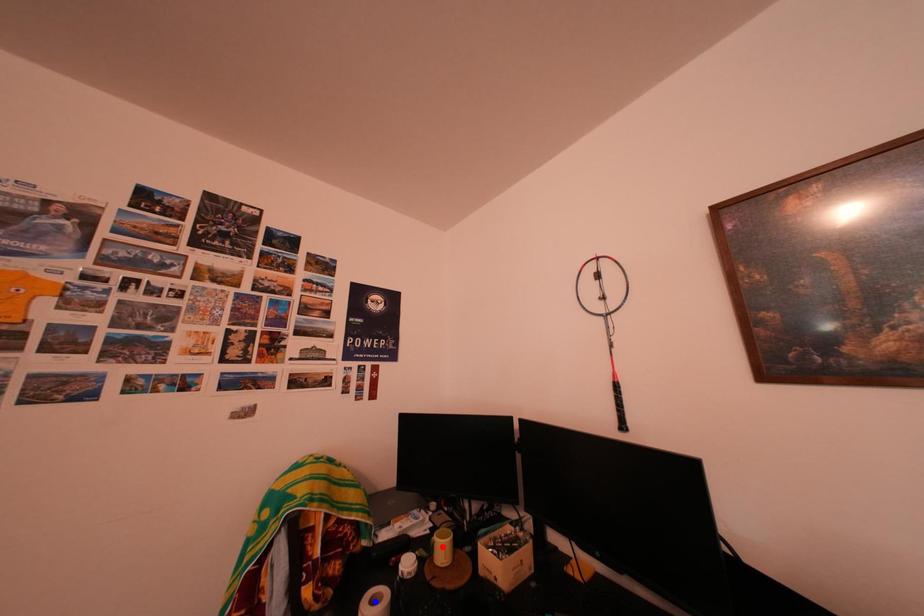
Question: Which of the two points in the image is closer to the camera?

Choices:
 (A) Blue point is closer.
 (B) Red point is closer.

Answer: (A)